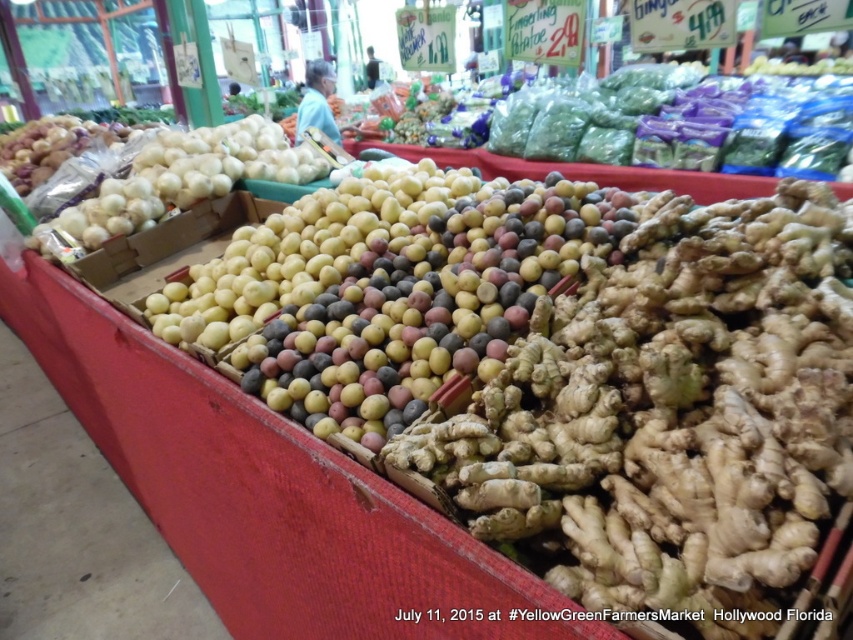
Measure the distance between point [294,272] and camera.

The distance of point [294,272] from camera is 4.92 feet.

Is yellow matte potatoes at center to the left of white matte onions at left from the viewer's perspective?

No, yellow matte potatoes at center is not to the left of white matte onions at left.

Find the location of a particular element. This screenshot has width=853, height=640. yellow matte potatoes at center is located at coordinates (300, 250).

Consider the image. How much distance is there between multicolored matte potatoes at center and white matte onions at left?

They are 38.50 inches apart.

Which is in front, point (508, 333) or point (155, 180)?

Point (508, 333) is in front.

Image resolution: width=853 pixels, height=640 pixels. What do you see at coordinates (426, 308) in the screenshot? I see `multicolored matte potatoes at center` at bounding box center [426, 308].

In order to click on multicolored matte potatoes at center in this screenshot , I will do `click(426, 308)`.

Does multicolored matte potatoes at center have a smaller size compared to yellow matte potatoes at center?

Correct, multicolored matte potatoes at center occupies less space than yellow matte potatoes at center.

Does point (460, 205) come closer to viewer compared to point (376, 205)?

Yes.

Is point (531, 196) positioned in front of point (305, 262)?

Yes, it is in front of point (305, 262).

Identify the location of multicolored matte potatoes at center. (426, 308).